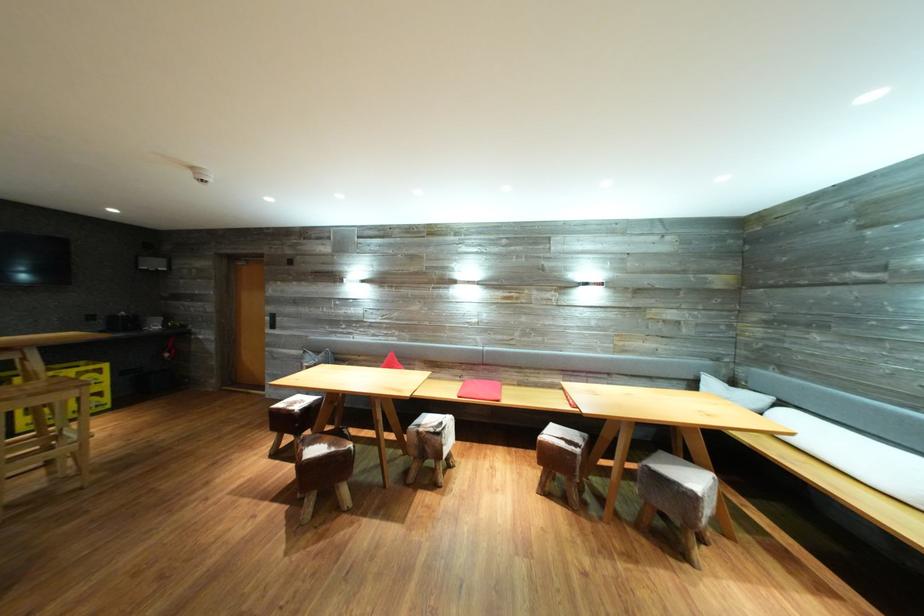
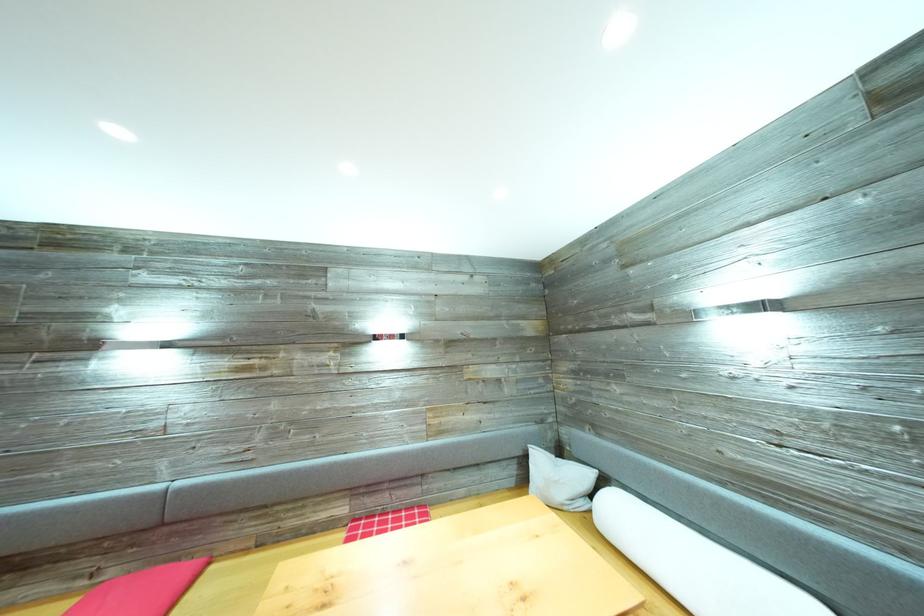
In the second image, find the point that corresponds to (x=472, y=383) in the first image.

(117, 578)